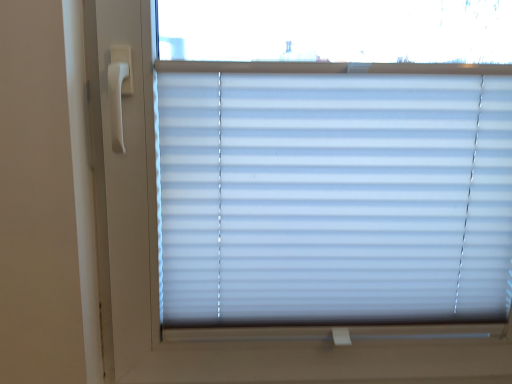
Image resolution: width=512 pixels, height=384 pixels. What do you see at coordinates (334, 197) in the screenshot?
I see `white matte blinds at center` at bounding box center [334, 197].

Where is `white matte blinds at center`? This screenshot has width=512, height=384. white matte blinds at center is located at coordinates (334, 197).

What are the coordinates of `white matte blinds at center` in the screenshot? It's located at (334, 197).